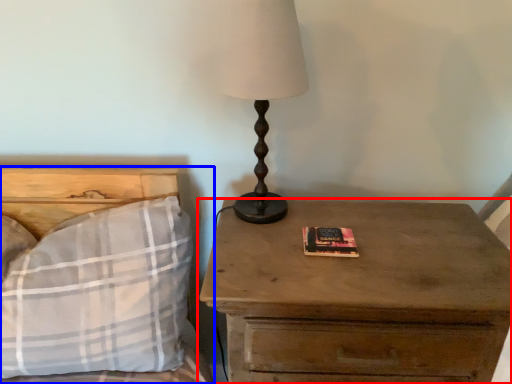
Question: Which of the following is the closest to the observer, nightstand (highlighted by a red box) or bed (highlighted by a blue box)?

Choices:
 (A) nightstand
 (B) bed

Answer: (A)